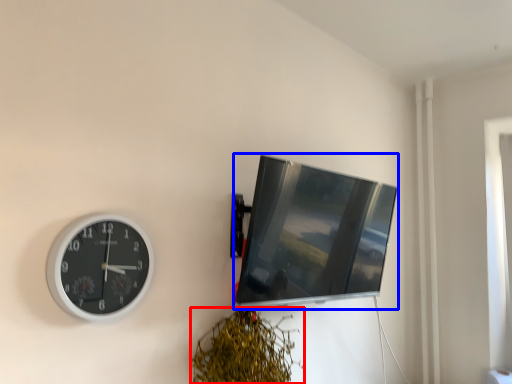
Question: Which object appears farthest to the camera in this image, vegetation (highlighted by a red box) or computer monitor (highlighted by a blue box)?

Choices:
 (A) vegetation
 (B) computer monitor

Answer: (B)